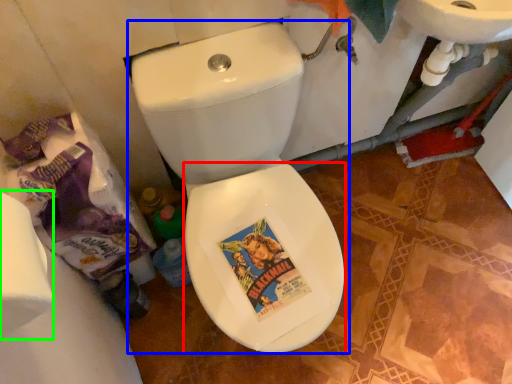
Question: Based on their relative distances, which object is nearer to bidet (highlighted by a red box)? Choose from toilet (highlighted by a blue box) and toilet paper (highlighted by a green box).

Choices:
 (A) toilet
 (B) toilet paper

Answer: (A)